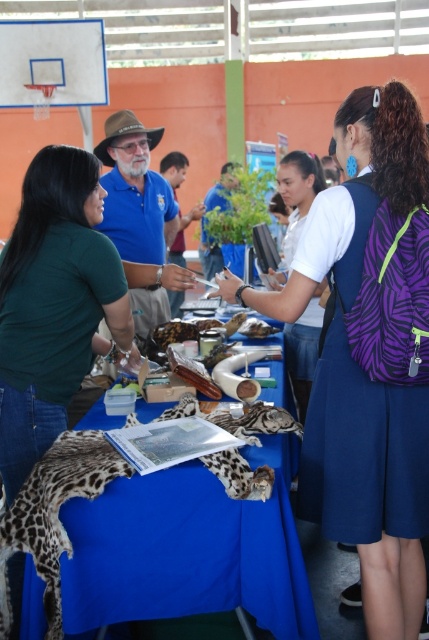
Question: Can you confirm if blue fabric table at center is positioned to the right of matte blue shirt at center?

Choices:
 (A) yes
 (B) no

Answer: (A)

Question: Is purple zebra-pattern backpack at upper right behind matte blue shirt at center?

Choices:
 (A) no
 (B) yes

Answer: (A)

Question: Which point is farther to the camera?

Choices:
 (A) (3, 390)
 (B) (296, 355)
 (C) (165, 269)

Answer: (B)

Question: Does blue fabric table at center appear on the right side of matte blue shirt at center?

Choices:
 (A) yes
 (B) no

Answer: (A)

Question: Which is farther from the green matte shirt at left?

Choices:
 (A) purple zebra-pattern backpack at upper right
 (B) matte blue shirt at center
 (C) blue fabric table at center

Answer: (A)

Question: Among these objects, which one is nearest to the camera?

Choices:
 (A) purple zebra-pattern backpack at upper right
 (B) white matte shirt at center
 (C) blue fabric table at center
 (D) matte blue shirt at center

Answer: (C)